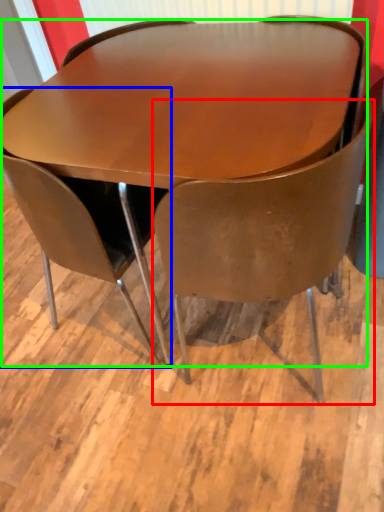
Question: Based on their relative distances, which object is nearer to chair (highlighted by a red box)? Choose from chair (highlighted by a blue box) and table (highlighted by a green box).

Choices:
 (A) chair
 (B) table

Answer: (B)